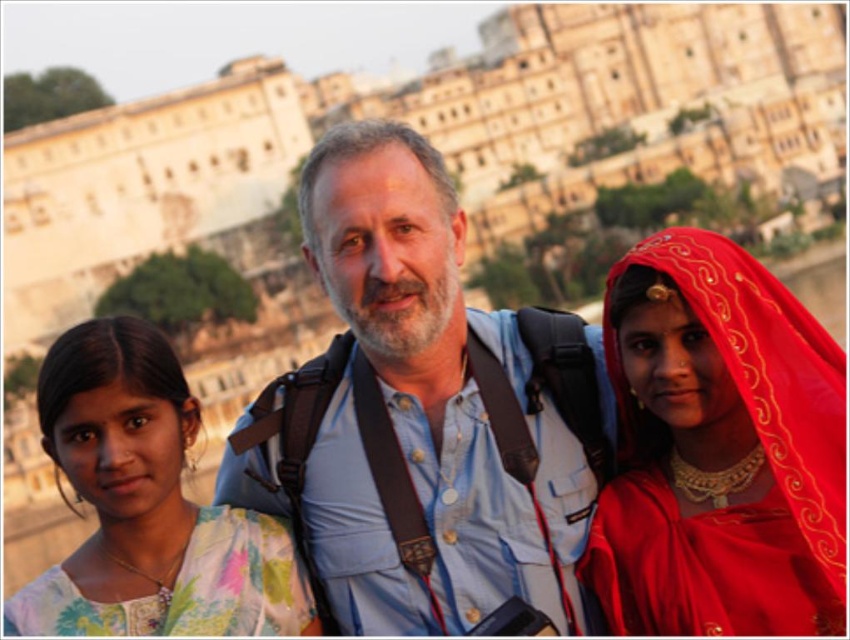
You are a photographer standing 10 meters away from the historic building. You want to take a photo that includes both the blue denim shirt at center and the matte red sari at center. Given their distance apart, will they both fit in your camera frame if your camera has a maximum field of view of 10 meters? Please explain.

The blue denim shirt at center and the matte red sari at center are 8.42 meters apart. Since the maximum field of view of the camera is 10 meters, which is greater than the distance between them, both subjects will fit within the frame.

You are standing in front of the historic building and see the blue denim shirt at center and the floral fabric dress at left. Which person is positioned closer to the right side of the building?

The blue denim shirt at center is positioned to the right of the floral fabric dress at left, so the person wearing the blue denim shirt at center is closer to the right side of the building.

You are standing in front of the historic building and want to take a photo of the two points mentioned. Which point, point (680, 556) or point (120, 592), is closer to you?

Point (680, 556) is closer to the viewer than point (120, 592).